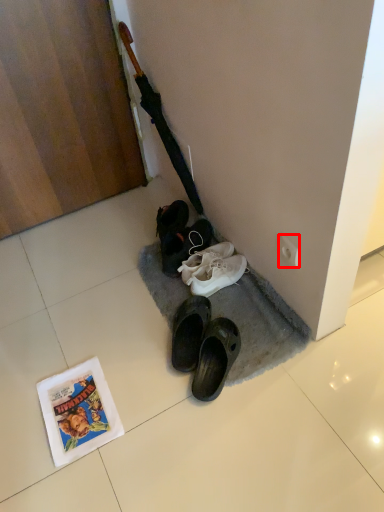
Question: From the image's perspective, where is power outlet (annotated by the red box) located relative to comic book?

Choices:
 (A) below
 (B) above

Answer: (B)